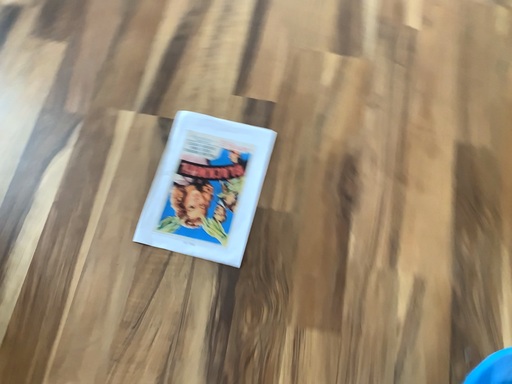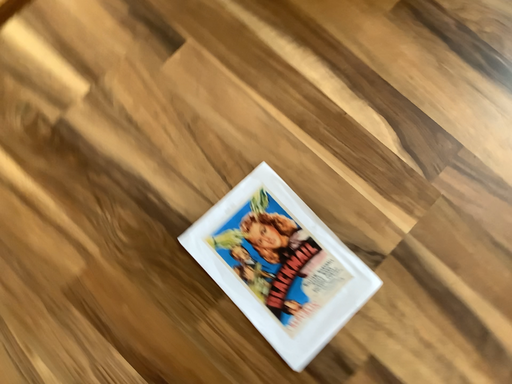
Question: How did the camera likely rotate when shooting the video?

Choices:
 (A) rotated downward
 (B) rotated upward

Answer: (B)